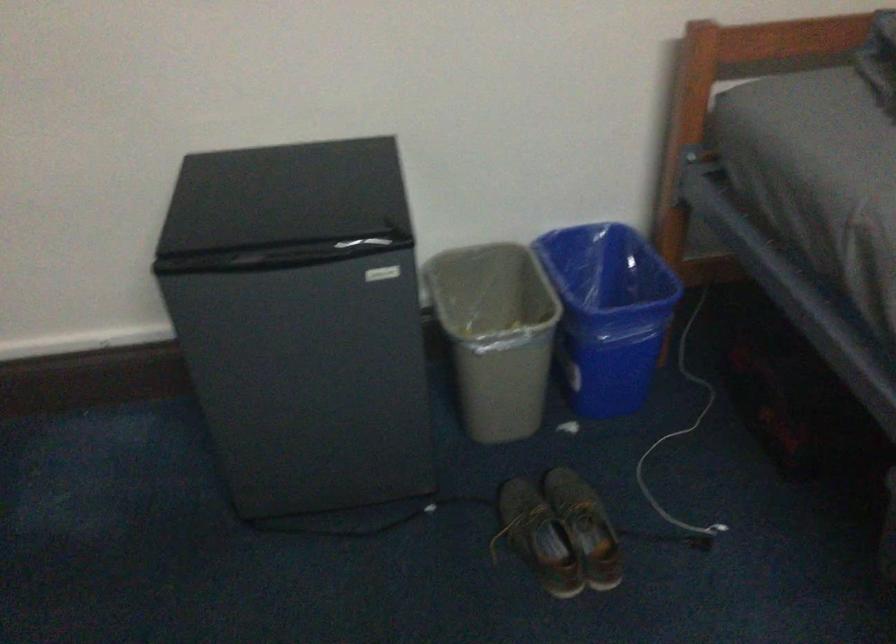
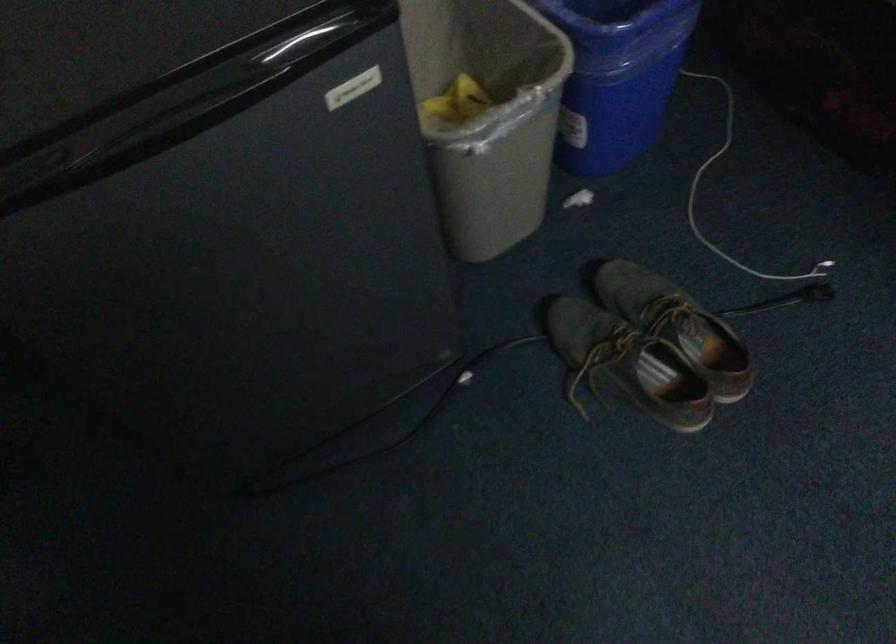
Find the pixel in the second image that matches point (678, 462) in the first image.

(734, 196)